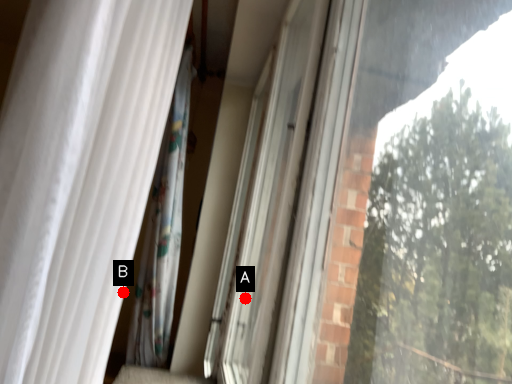
Question: Two points are circled on the image, labeled by A and B beside each circle. Which of the following is the farthest from the observer?

Choices:
 (A) A is further
 (B) B is further

Answer: (A)